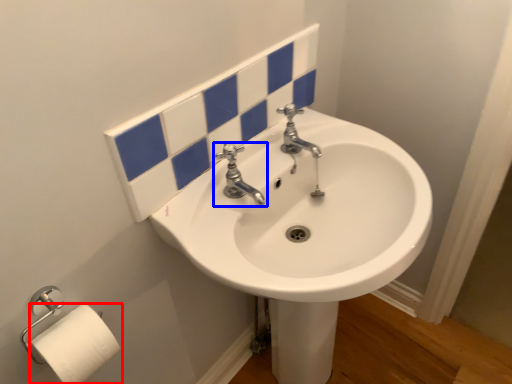
Question: Which object is further to the camera taking this photo, toilet paper (highlighted by a red box) or tap (highlighted by a blue box)?

Choices:
 (A) toilet paper
 (B) tap

Answer: (B)